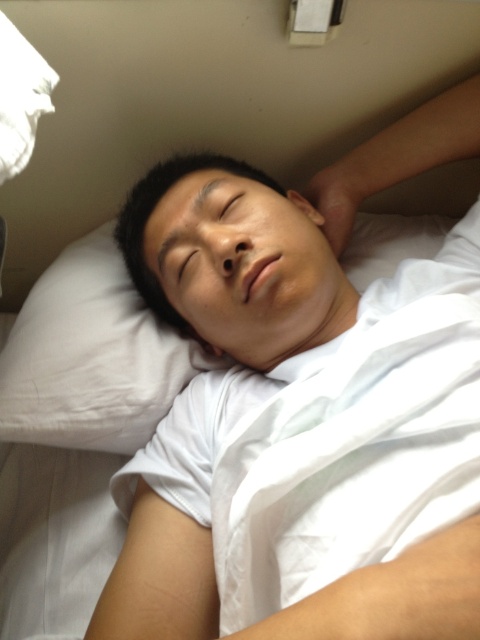
Question: Which object appears farthest from the camera in this image?

Choices:
 (A) smooth skin head at center
 (B) brown matte eye at center
 (C) white soft pillow at upper left
 (D) white soft pillow at center

Answer: (C)

Question: From the image, what is the correct spatial relationship of smooth skin head at center in relation to white soft pillow at upper left?

Choices:
 (A) below
 (B) above

Answer: (B)

Question: Which of the following is the farthest from the observer?

Choices:
 (A) black matte eye at upper center
 (B) white soft pillow at upper left

Answer: (B)

Question: Is white soft pillow at upper left thinner than brown matte eye at center?

Choices:
 (A) no
 (B) yes

Answer: (A)

Question: Which object is closer to the camera taking this photo?

Choices:
 (A) white soft pillow at upper left
 (B) white cotton shirt at center
 (C) smooth skin head at center

Answer: (B)

Question: Is brown matte eye at center above black matte eye at upper center?

Choices:
 (A) yes
 (B) no

Answer: (B)